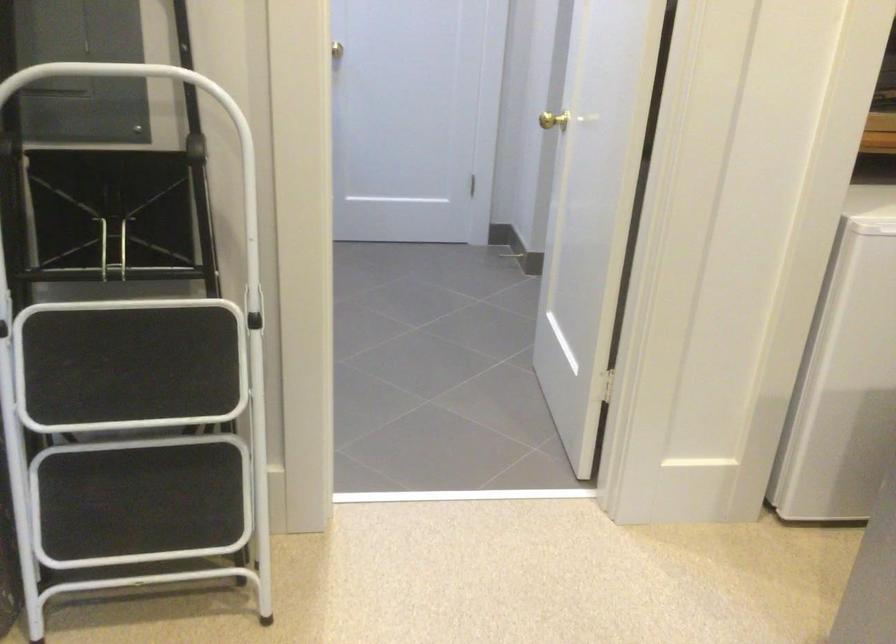
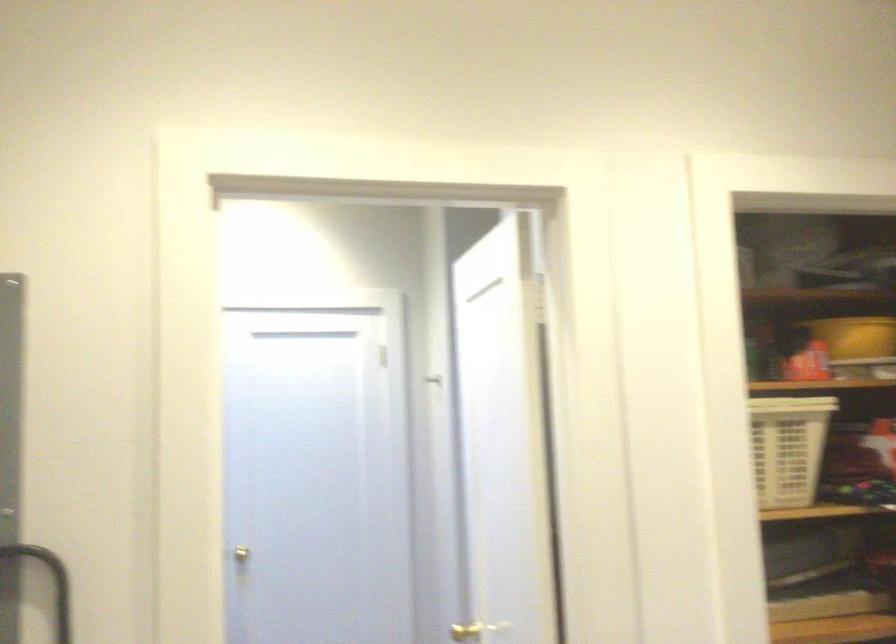
Question: Based on the continuous images, in which direction is the camera rotating? Reply with the corresponding letter.

Choices:
 (A) Left
 (B) Right
 (C) Up
 (D) Down

Answer: (C)